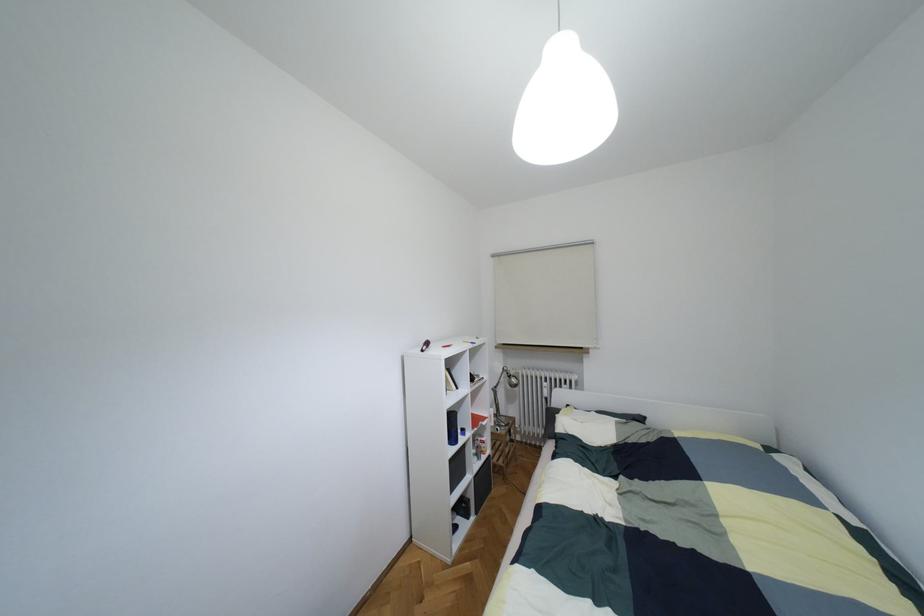
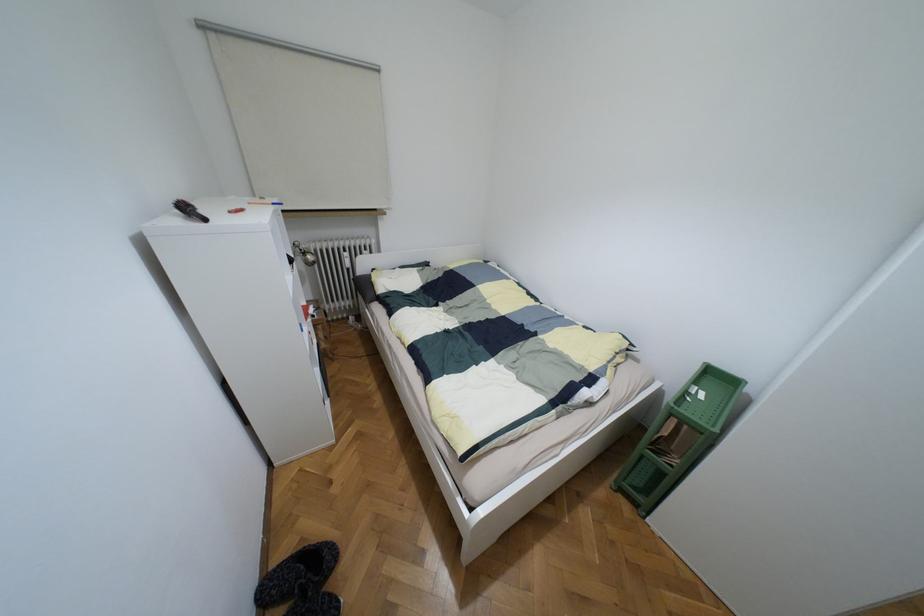
How did the camera likely rotate?

The camera's rotation is toward right-down.